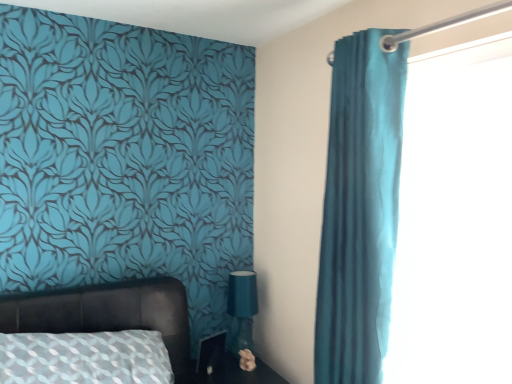
Question: Considering the positions of matte black side table at lower center and leather-like bed at lower left in the image, is matte black side table at lower center taller or shorter than leather-like bed at lower left?

Choices:
 (A) short
 (B) tall

Answer: (A)

Question: From a real-world perspective, is matte black side table at lower center above or below leather-like bed at lower left?

Choices:
 (A) above
 (B) below

Answer: (B)

Question: Considering the real-world distances, which object is closest to the teal fabric curtain at right?

Choices:
 (A) matte teal fabric at lower center
 (B) fluffy beige flower at lower center
 (C) matte black side table at lower center
 (D) teal fabric curtain at right
 (E) leather-like bed at lower left

Answer: (D)

Question: Which of these objects is positioned closest to the leather-like bed at lower left?

Choices:
 (A) teal fabric curtain at right
 (B) matte black side table at lower center
 (C) teal fabric curtain at right
 (D) matte teal fabric at lower center
 (E) fluffy beige flower at lower center

Answer: (B)